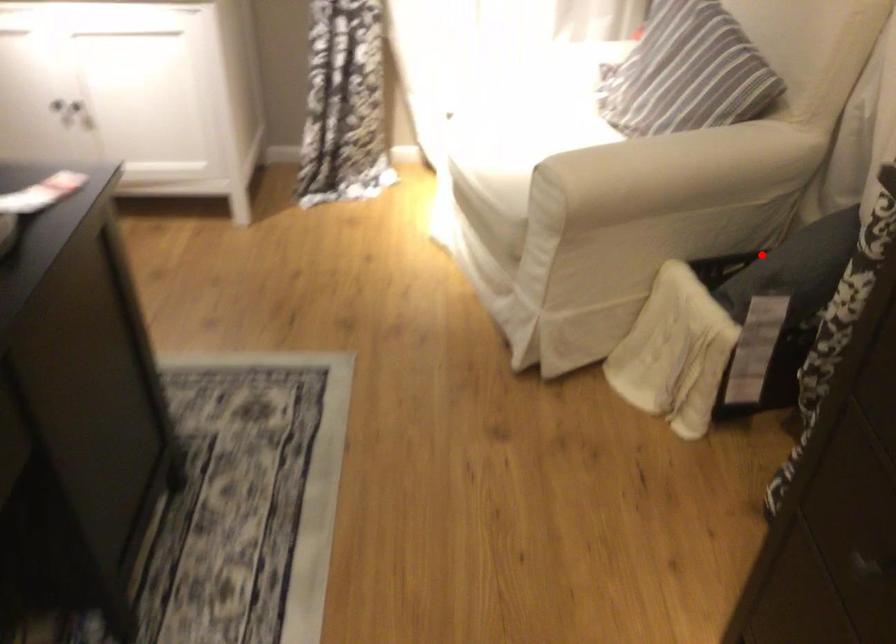
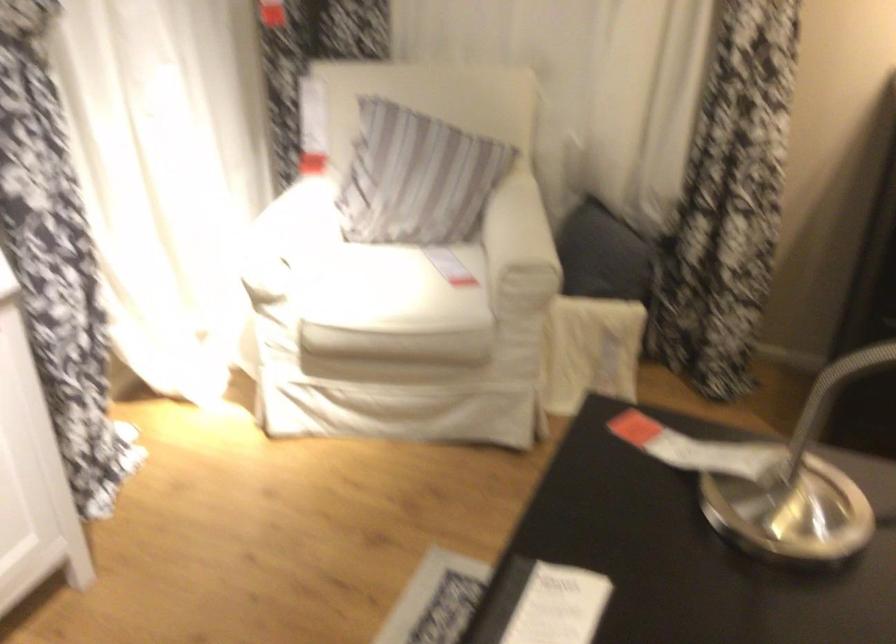
Find the pixel in the second image that matches the highlighted location in the first image.

(604, 254)